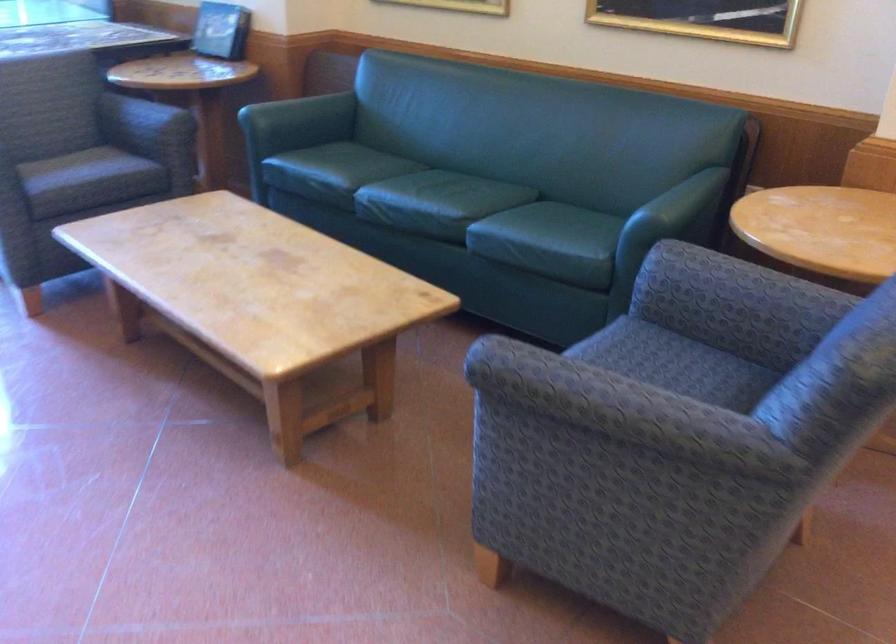
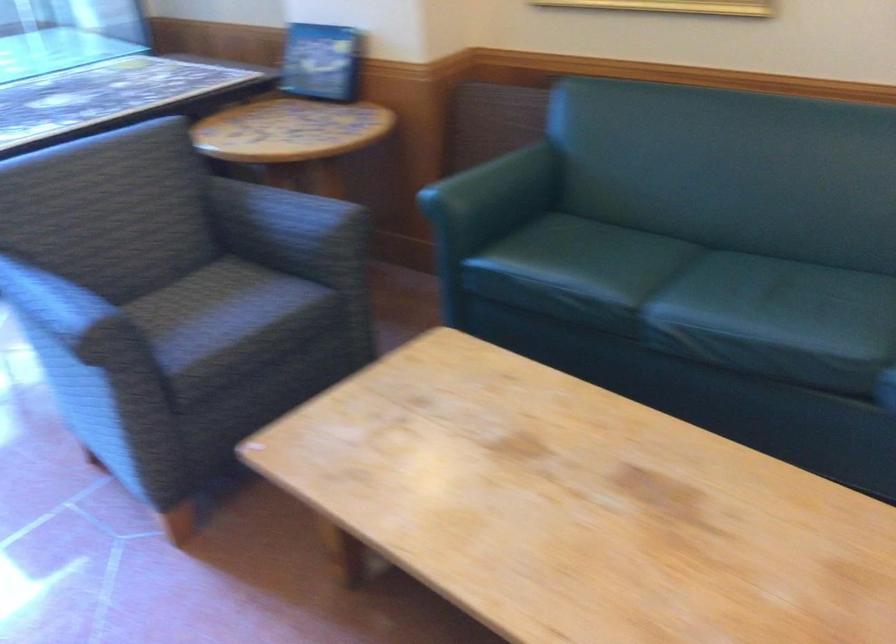
Find the pixel in the second image that matches (141,108) in the first image.

(287, 211)